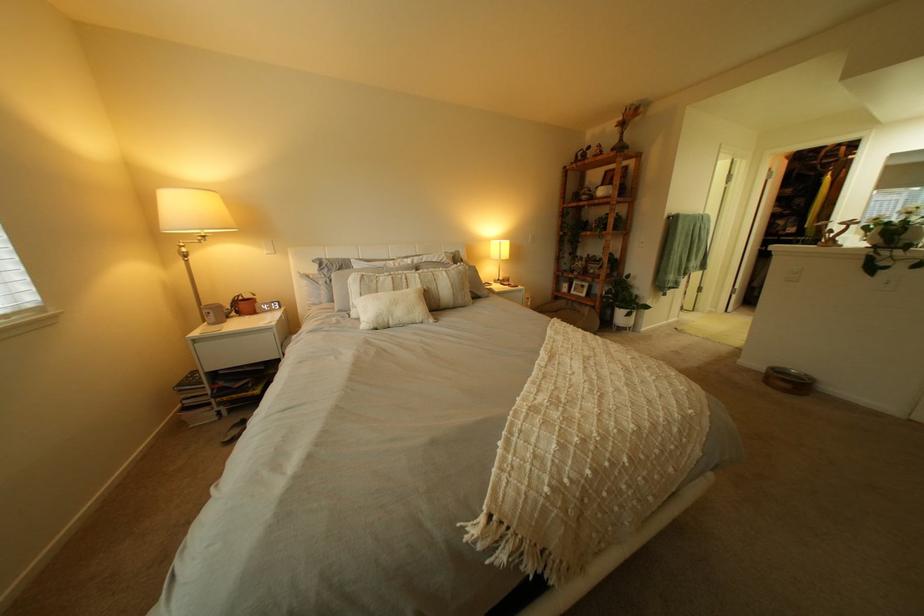
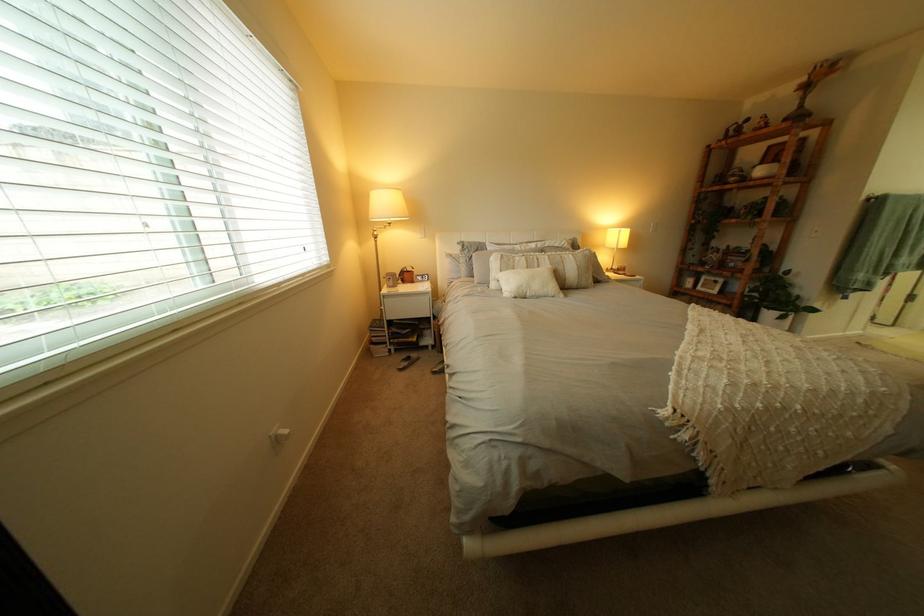
What movement of the cameraman would produce the second image?

The movement direction of the cameraman is left, backward.